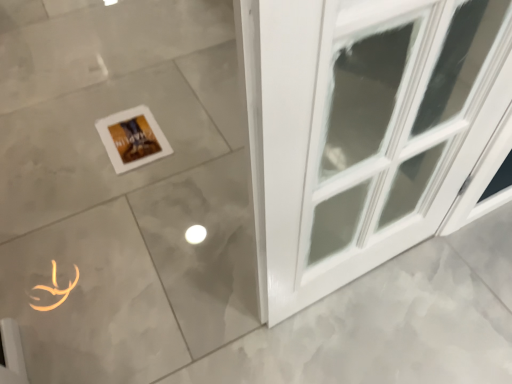
The width and height of the screenshot is (512, 384). What do you see at coordinates (123, 189) in the screenshot?
I see `matte gray tile at center` at bounding box center [123, 189].

Where is `matte gray tile at center`? The image size is (512, 384). matte gray tile at center is located at coordinates (123, 189).

You are a GUI agent. You are given a task and a screenshot of the screen. Output one action in this format:
    pyautogui.click(x=<x>, y=<y>)
    Task: Click on the white matte picture frame at center
    Image resolution: width=512 pixels, height=384 pixels.
    Given the screenshot: What is the action you would take?
    pyautogui.click(x=132, y=138)

What do you see at coordinates (132, 138) in the screenshot?
I see `white matte picture frame at center` at bounding box center [132, 138].

Identify the location of matte gray tile at center. (123, 189).

Can you confirm if matte gray tile at center is positioned to the left of white matte picture frame at center?

No, matte gray tile at center is not to the left of white matte picture frame at center.

Is the position of matte gray tile at center more distant than that of white matte picture frame at center?

No, it is in front of white matte picture frame at center.

Does point (16, 26) come closer to viewer compared to point (114, 122)?

No, (16, 26) is further to viewer.

From the image's perspective, is matte gray tile at center located above white matte picture frame at center?

Yes, from the image's perspective, matte gray tile at center is on top of white matte picture frame at center.

From a real-world perspective, is matte gray tile at center physically above white matte picture frame at center?

No, from a real-world perspective, matte gray tile at center is not above white matte picture frame at center.

Does matte gray tile at center have a greater width compared to white matte picture frame at center?

Yes, matte gray tile at center is wider than white matte picture frame at center.

From their relative heights in the image, would you say matte gray tile at center is taller or shorter than white matte picture frame at center?

matte gray tile at center is taller than white matte picture frame at center.

Between matte gray tile at center and white matte picture frame at center, which one has larger size?

matte gray tile at center is bigger.

Is matte gray tile at center surrounding white matte picture frame at center?

Indeed, white matte picture frame at center is located within matte gray tile at center.

Is matte gray tile at center positioned far away from white matte picture frame at center?

Actually, matte gray tile at center and white matte picture frame at center are a little close together.

Could you tell me if matte gray tile at center is facing white matte picture frame at center?

No, matte gray tile at center is not oriented towards white matte picture frame at center.

The width and height of the screenshot is (512, 384). Find the location of `picture frame that is on the left side of matte gray tile at center`. picture frame that is on the left side of matte gray tile at center is located at coordinates (132, 138).

Is white matte picture frame at center to the right of matte gray tile at center from the viewer's perspective?

Incorrect, white matte picture frame at center is not on the right side of matte gray tile at center.

Which object is further away from the camera, white matte picture frame at center or matte gray tile at center?

white matte picture frame at center is further away from the camera.

Is point (156, 129) closer or farther from the camera than point (155, 46)?

Point (156, 129) appears to be closer to the viewer than point (155, 46).

From the image's perspective, is white matte picture frame at center above or below matte gray tile at center?

white matte picture frame at center is situated lower than matte gray tile at center in the image.

From a real-world perspective, is white matte picture frame at center positioned above or below matte gray tile at center?

white matte picture frame at center is above matte gray tile at center.

Considering the sizes of objects white matte picture frame at center and matte gray tile at center in the image provided, who is thinner, white matte picture frame at center or matte gray tile at center?

Thinner between the two is white matte picture frame at center.

Is white matte picture frame at center taller than matte gray tile at center?

In fact, white matte picture frame at center may be shorter than matte gray tile at center.

Considering the sizes of objects white matte picture frame at center and matte gray tile at center in the image provided, who is smaller, white matte picture frame at center or matte gray tile at center?

white matte picture frame at center is smaller.

Is white matte picture frame at center inside or outside of matte gray tile at center?

white matte picture frame at center fits inside matte gray tile at center.

Are white matte picture frame at center and matte gray tile at center far apart?

No, white matte picture frame at center is not far from matte gray tile at center.

Is white matte picture frame at center facing towards matte gray tile at center?

Yes, white matte picture frame at center is aimed at matte gray tile at center.

The height and width of the screenshot is (384, 512). There is a matte gray tile at center. Find the location of `picture frame above it (from a real-world perspective)`. picture frame above it (from a real-world perspective) is located at coordinates (132, 138).

Identify the location of ceramic tile above the white matte picture frame at center (from the image's perspective). (123, 189).

Where is `picture frame below the matte gray tile at center (from the image's perspective)`? The width and height of the screenshot is (512, 384). picture frame below the matte gray tile at center (from the image's perspective) is located at coordinates (132, 138).